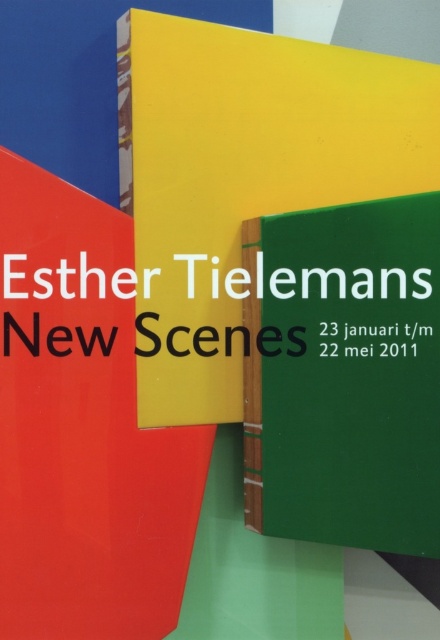
Question: Among these objects, which one is farthest from the camera?

Choices:
 (A) green matte signboard at center
 (B) black matte text at center

Answer: (B)

Question: Does green matte signboard at center appear over black paper at center?

Choices:
 (A) no
 (B) yes

Answer: (A)

Question: Can you confirm if matte yellow poster at center is positioned to the right of green matte signboard at center?

Choices:
 (A) yes
 (B) no

Answer: (B)

Question: Which point appears farthest from the camera in this image?

Choices:
 (A) (25, 552)
 (B) (158, 156)
 (C) (21, 339)
 (D) (378, 428)

Answer: (B)

Question: Is matte red book at center bigger than green matte signboard at center?

Choices:
 (A) no
 (B) yes

Answer: (B)

Question: Among these objects, which one is nearest to the camera?

Choices:
 (A) green matte signboard at center
 (B) matte red book at center

Answer: (B)